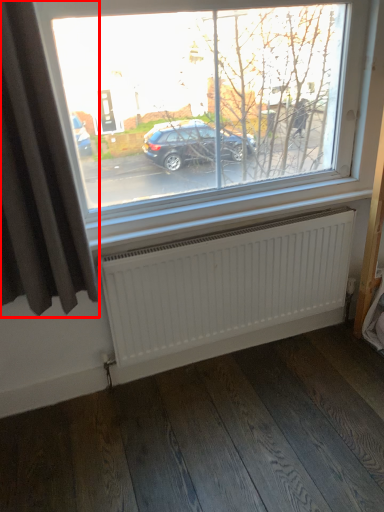
Question: From the image, what is the correct spatial relationship of curtain (annotated by the red box) in relation to radiator?

Choices:
 (A) right
 (B) left

Answer: (B)